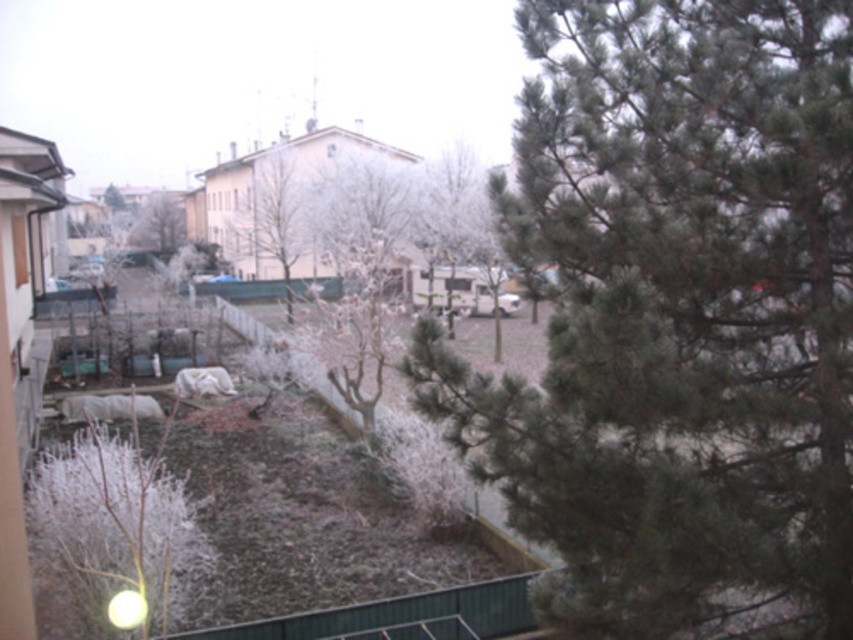
Question: Among these objects, which one is nearest to the camera?

Choices:
 (A) bare wood tree at center
 (B) green needle-like tree at right

Answer: (B)

Question: Is green needle-like tree at right below bare wood tree at center?

Choices:
 (A) no
 (B) yes

Answer: (B)

Question: Can you confirm if bare wood tree at center is positioned above green matte tree at center?

Choices:
 (A) no
 (B) yes

Answer: (A)

Question: Can you confirm if white frosty branch at lower left is positioned to the right of white frosty tree at center?

Choices:
 (A) no
 (B) yes

Answer: (B)

Question: Which of these objects is positioned closest to the white frosty tree at center?

Choices:
 (A) bare wood tree at center
 (B) green needle-like tree at right

Answer: (A)

Question: Which object appears closest to the camera in this image?

Choices:
 (A) green matte tree at center
 (B) green needle-like tree at right
 (C) bare wood tree at center
 (D) white frosty branch at lower left

Answer: (B)